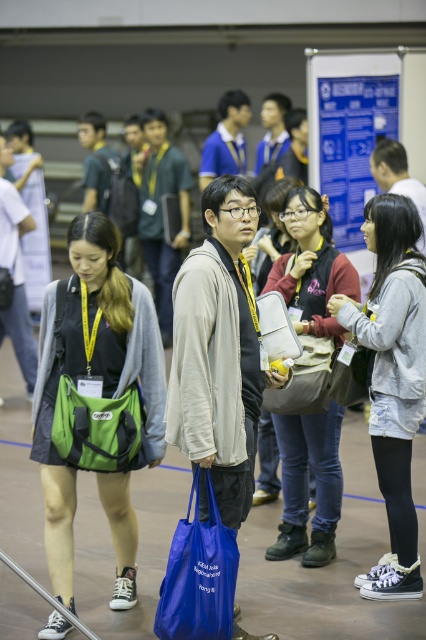
Question: Which object is positioned closest to the green fabric bag at left?

Choices:
 (A) gray cotton hoodie at center
 (B) matte gray backpack at center
 (C) matte gray bag at center
 (D) blue fabric bag at center

Answer: (D)

Question: Does gray cotton hoodie at center have a greater width compared to matte gray bag at center?

Choices:
 (A) no
 (B) yes

Answer: (B)

Question: Is gray cotton hoodie at center positioned at the back of green fabric bag at lower left?

Choices:
 (A) no
 (B) yes

Answer: (B)

Question: Considering the real-world distances, which object is closest to the gray cotton hoodie at center?

Choices:
 (A) matte gray backpack at center
 (B) green fabric bag at left
 (C) green fabric bag at lower left

Answer: (A)

Question: Does green fabric bag at left have a lesser width compared to green fabric bag at lower left?

Choices:
 (A) no
 (B) yes

Answer: (A)

Question: Which of the following is the closest to the observer?

Choices:
 (A) gray cotton hoodie at center
 (B) matte gray backpack at center
 (C) blue fabric bag at center
 (D) matte gray bag at center

Answer: (C)